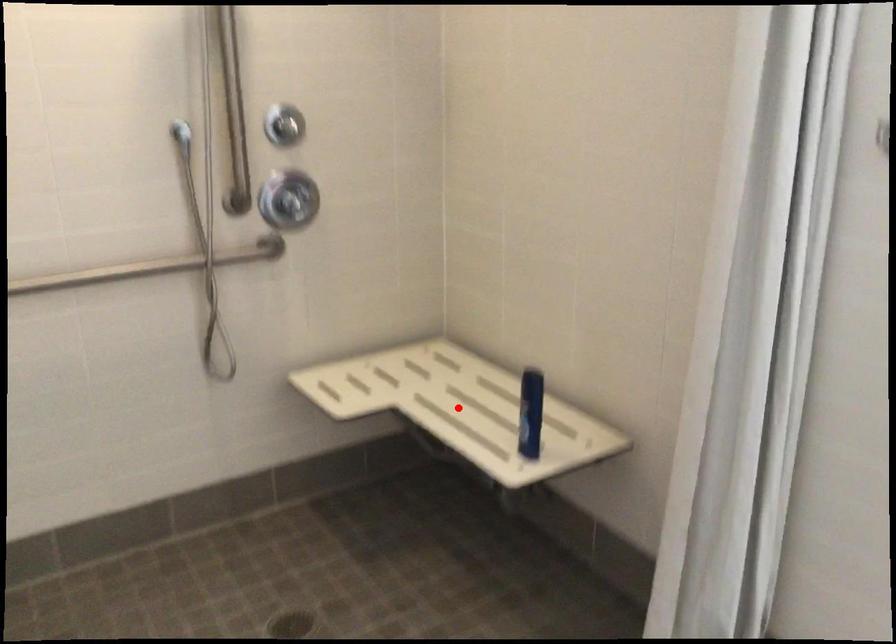
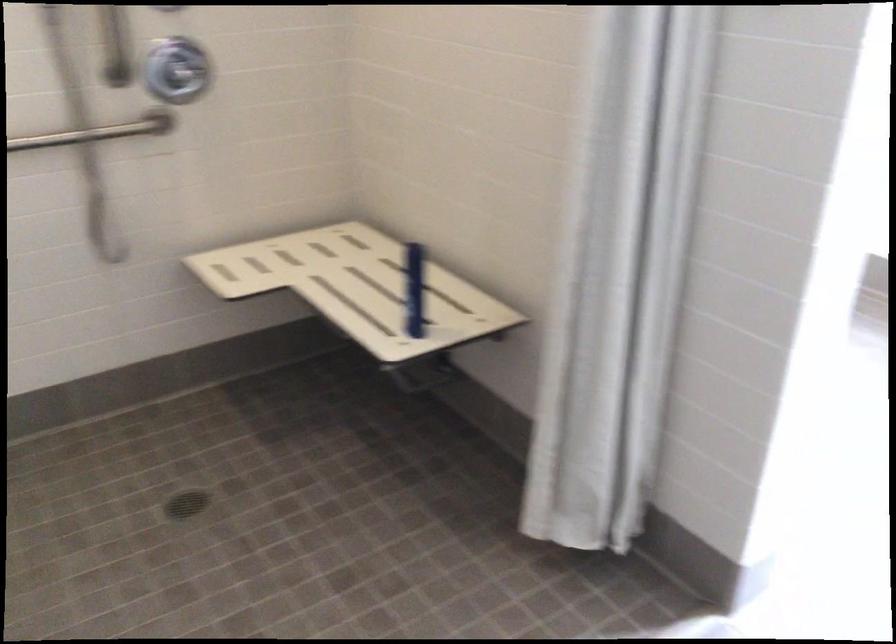
The point at the highlighted location is marked in the first image. Where is the corresponding point in the second image?

(357, 287)